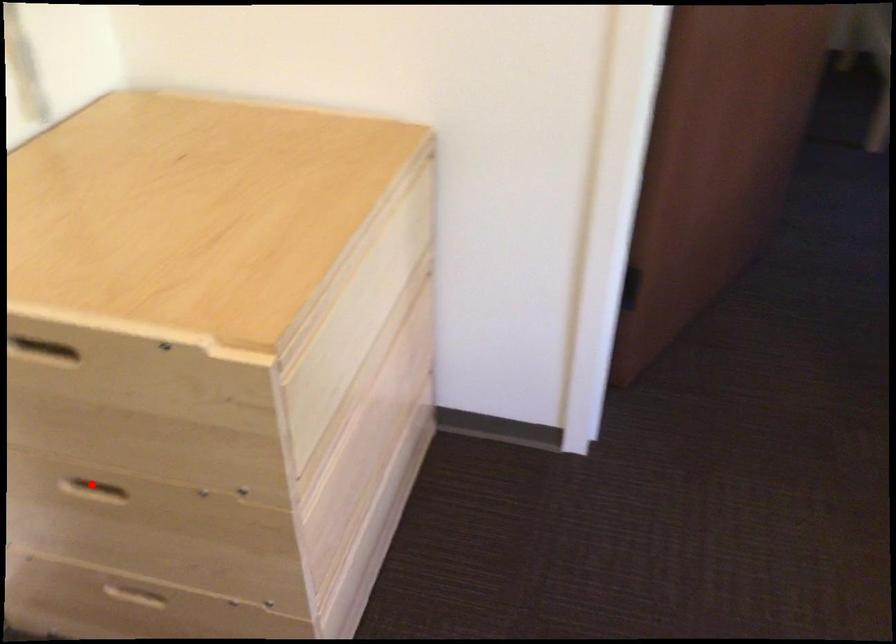
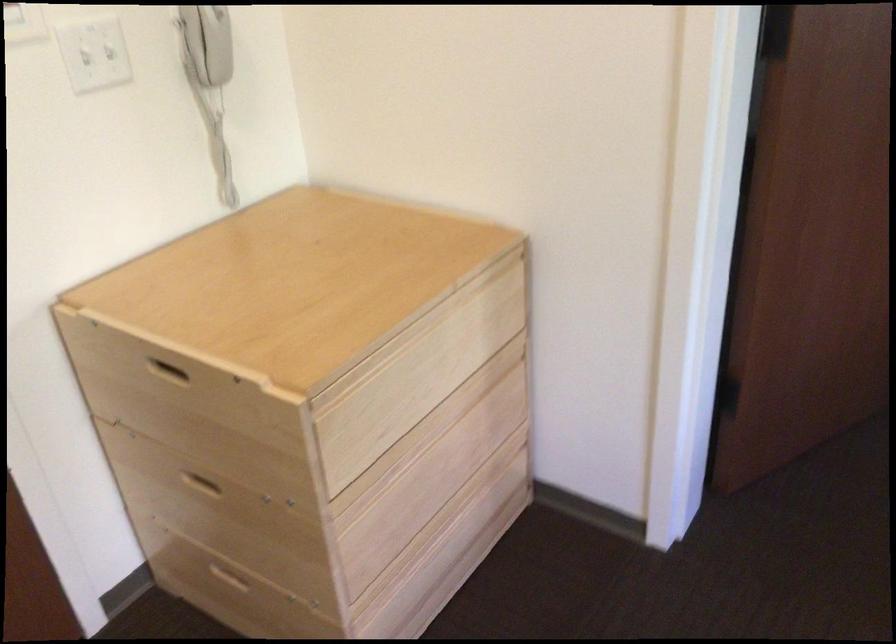
Question: I am providing you with two images of the same scene from different viewpoints. In image1, a red point is highlighted. Considering the same 3D point in image2, which of the following is correct?

Choices:
 (A) It is closer
 (B) It is farther

Answer: (B)